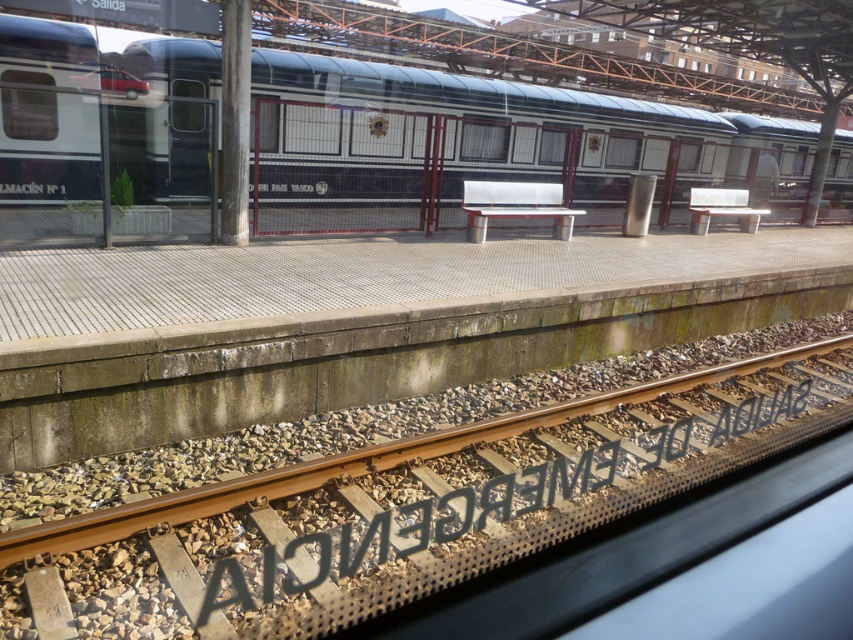
Question: Is brown gravel track at lower center thinner than polished metal train at center?

Choices:
 (A) yes
 (B) no

Answer: (A)

Question: Is brown gravel track at lower center further to the viewer compared to polished metal train at center?

Choices:
 (A) yes
 (B) no

Answer: (B)

Question: Which of the following is the farthest from the observer?

Choices:
 (A) (36, 116)
 (B) (677, 429)

Answer: (A)

Question: Is the position of brown gravel track at lower center more distant than that of polished metal train at center?

Choices:
 (A) yes
 (B) no

Answer: (B)

Question: Which point is closer to the camera taking this photo?

Choices:
 (A) (260, 616)
 (B) (3, 188)

Answer: (A)

Question: Which point is farther to the camera?

Choices:
 (A) click(479, 177)
 (B) click(395, 483)

Answer: (A)